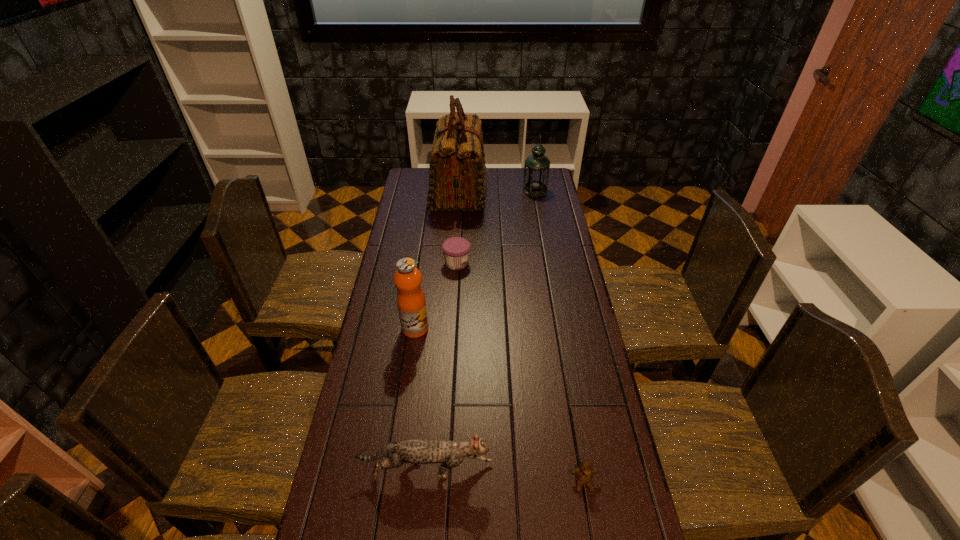
Locate an element on the screen. This screenshot has width=960, height=540. blank space at the far edge is located at coordinates (496, 177).

Where is `free space at the left edge of the desktop`? free space at the left edge of the desktop is located at coordinates (396, 295).

In order to click on free location at the right edge in this screenshot , I will do `click(583, 420)`.

You are a GUI agent. You are given a task and a screenshot of the screen. Output one action in this format:
    pyautogui.click(x=<x>, y=<y>)
    Task: Click on the free space at the far left corner
    This screenshot has width=960, height=540.
    Given the screenshot: What is the action you would take?
    pyautogui.click(x=424, y=179)

Locate an element on the screen. Image resolution: width=960 pixels, height=540 pixels. blank region between the fourth tallest object and the fourth farthest object is located at coordinates (420, 399).

Identify the location of empty space that is in between the jam and the fourth tallest object. (442, 367).

Identify the location of free point between the jam and the oil lamp. Image resolution: width=960 pixels, height=540 pixels. (496, 227).

Where is `free spot between the fourth tallest object and the fruit juice`? The image size is (960, 540). free spot between the fourth tallest object and the fruit juice is located at coordinates (420, 399).

Where is `free space between the jam and the shopping bag`? The height and width of the screenshot is (540, 960). free space between the jam and the shopping bag is located at coordinates (458, 227).

At what (x,y) coordinates should I click in order to perform the action: click on free space that is in between the fourth nearest object and the teddy bear. Please return your answer as a coordinate pair (x, y). Looking at the image, I should click on (520, 373).